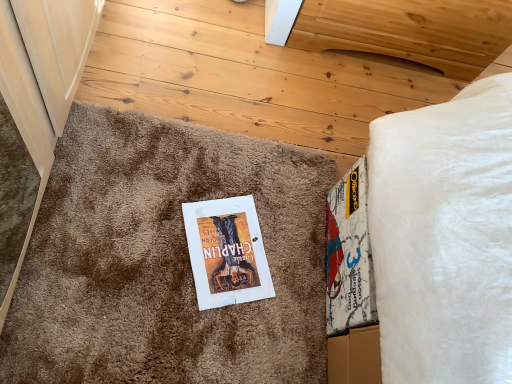
Question: Looking at their shapes, would you say brown shaggy carpet at center is wider or thinner than white paper book at center?

Choices:
 (A) thin
 (B) wide

Answer: (B)

Question: Is brown shaggy carpet at center to the left or to the right of white paper book at center in the image?

Choices:
 (A) right
 (B) left

Answer: (B)

Question: Considering the real-world distances, which object is farthest from the white paper book at center?

Choices:
 (A) brown shaggy carpet at center
 (B) natural wood headboard at upper center

Answer: (B)

Question: Based on their relative distances, which object is nearer to the brown shaggy carpet at center?

Choices:
 (A) natural wood headboard at upper center
 (B) white paper book at center

Answer: (B)